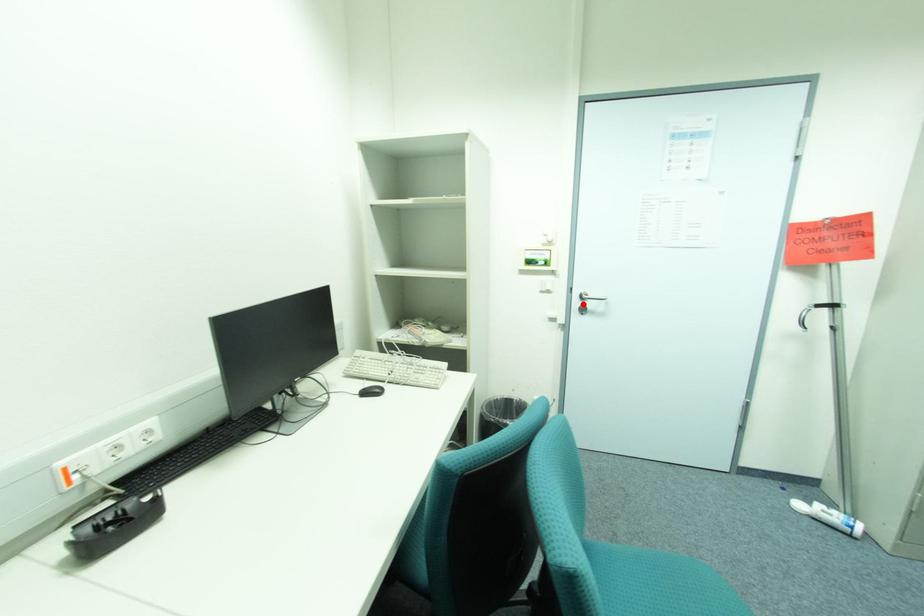
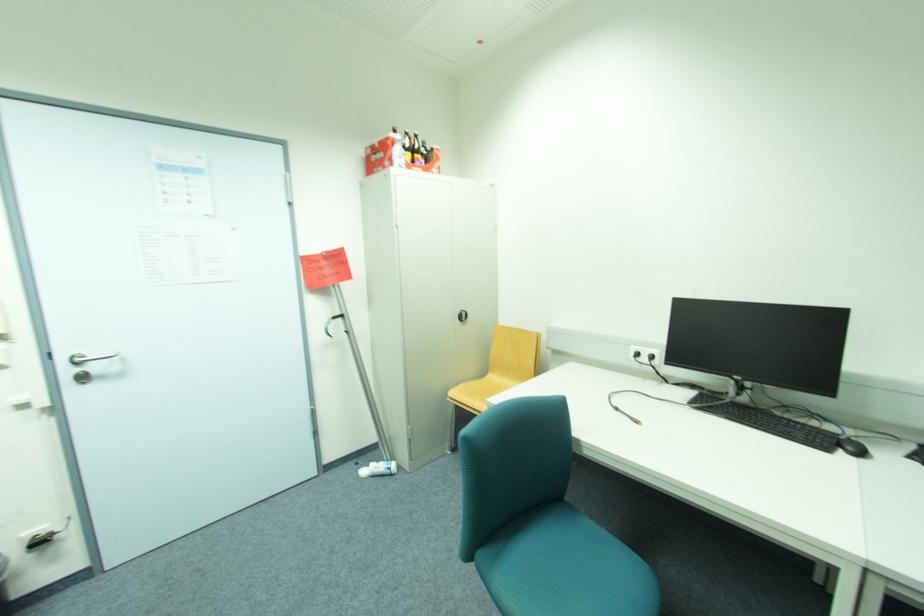
Locate, in the second image, the point that corresponds to the highlighted location in the first image.

(74, 371)